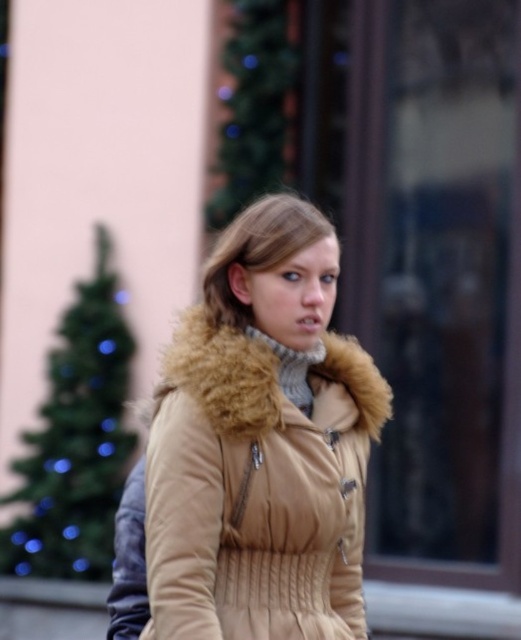
Question: Can you confirm if tan quilted coat at center is wider than beige fur-trimmed coat at center?

Choices:
 (A) yes
 (B) no

Answer: (A)

Question: Does tan quilted coat at center appear under beige fur-trimmed coat at center?

Choices:
 (A) yes
 (B) no

Answer: (A)

Question: Which object is closer to the camera taking this photo?

Choices:
 (A) tan quilted coat at center
 (B) beige fur-trimmed coat at center

Answer: (A)

Question: Which of the following is the farthest from the observer?

Choices:
 (A) (279, 630)
 (B) (222, 257)

Answer: (B)

Question: Does tan quilted coat at center appear on the left side of beige fur-trimmed coat at center?

Choices:
 (A) yes
 (B) no

Answer: (B)